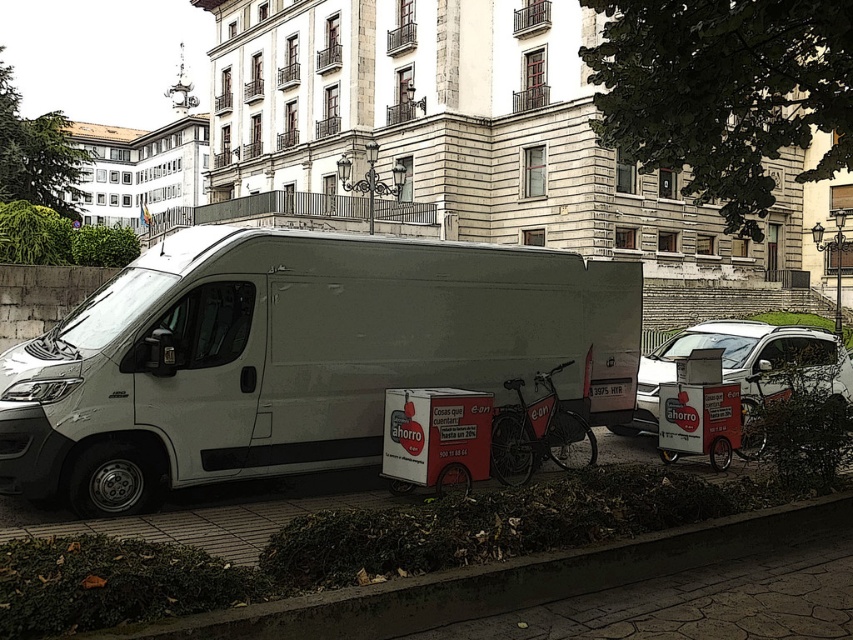
Question: Observing the image, what is the correct spatial positioning of metallic red cooler at center in reference to red matte bicycle at center?

Choices:
 (A) right
 (B) left

Answer: (B)

Question: Considering the real-world distances, which object is closest to the white matte van at center?

Choices:
 (A) metallic red cooler at center
 (B) concrete at lower left
 (C) white matte car at center
 (D) red matte bicycle at center

Answer: (A)

Question: Which object is closer to the camera taking this photo?

Choices:
 (A) white matte car at center
 (B) metallic red cooler at center
 (C) red matte bicycle at center

Answer: (B)

Question: Among these points, which one is farthest from the camera?

Choices:
 (A) (369, 300)
 (B) (401, 580)
 (C) (608, 428)
 (D) (576, 433)

Answer: (C)

Question: Is white matte car at center smaller than red matte bicycle at center?

Choices:
 (A) no
 (B) yes

Answer: (B)

Question: Does white matte car at center have a smaller size compared to metallic red cooler at center?

Choices:
 (A) no
 (B) yes

Answer: (B)